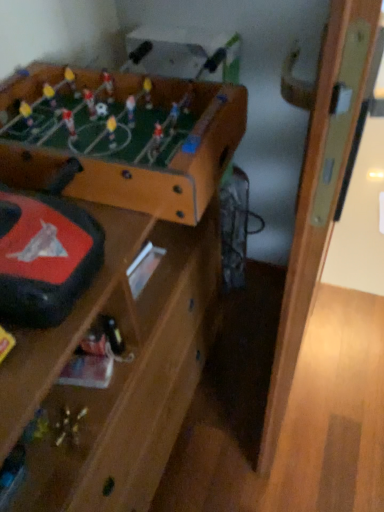
Question: Is wooden foosball table at upper left situated inside metallic silver toy at center or outside?

Choices:
 (A) outside
 (B) inside

Answer: (A)

Question: Is wooden foosball table at upper left to the left or to the right of metallic silver toy at center in the image?

Choices:
 (A) right
 (B) left

Answer: (B)

Question: Based on their relative distances, which object is nearer to the wooden door at right?

Choices:
 (A) wooden foosball table at upper left
 (B) metallic silver toy at center

Answer: (A)

Question: Estimate the real-world distances between objects in this image. Which object is farther from the metallic silver toy at center?

Choices:
 (A) wooden foosball table at upper left
 (B) wooden door at right

Answer: (B)